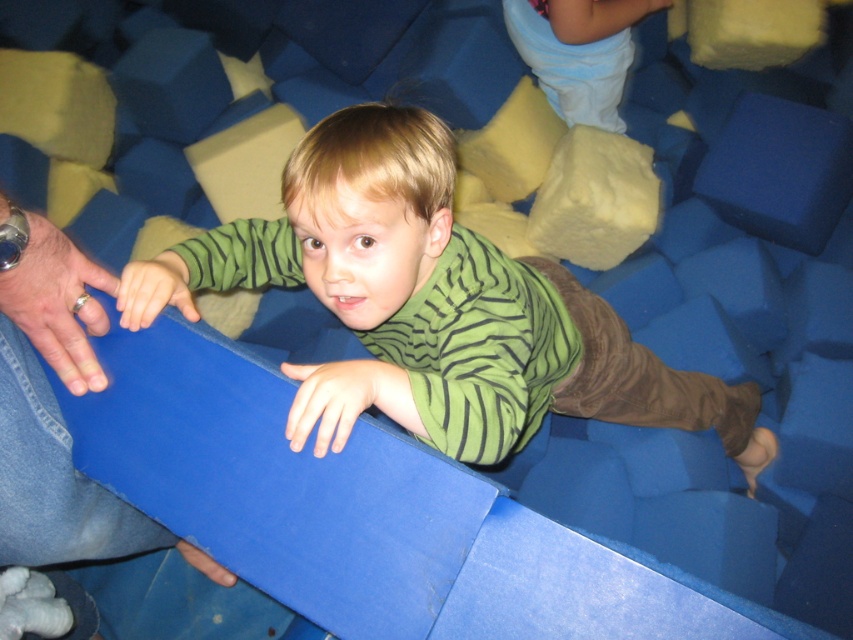
Question: Does green striped shirt at center appear under light blue fabric pants at upper center?

Choices:
 (A) no
 (B) yes

Answer: (B)

Question: Does green striped shirt at center have a greater width compared to light blue fabric pants at upper center?

Choices:
 (A) no
 (B) yes

Answer: (B)

Question: Which point is closer to the camera?

Choices:
 (A) green striped shirt at center
 (B) light blue fabric pants at upper center

Answer: (A)

Question: Which point is closer to the camera?

Choices:
 (A) green striped shirt at center
 (B) light blue fabric pants at upper center

Answer: (A)

Question: Where is green striped shirt at center located in relation to light blue fabric pants at upper center in the image?

Choices:
 (A) below
 (B) above

Answer: (A)